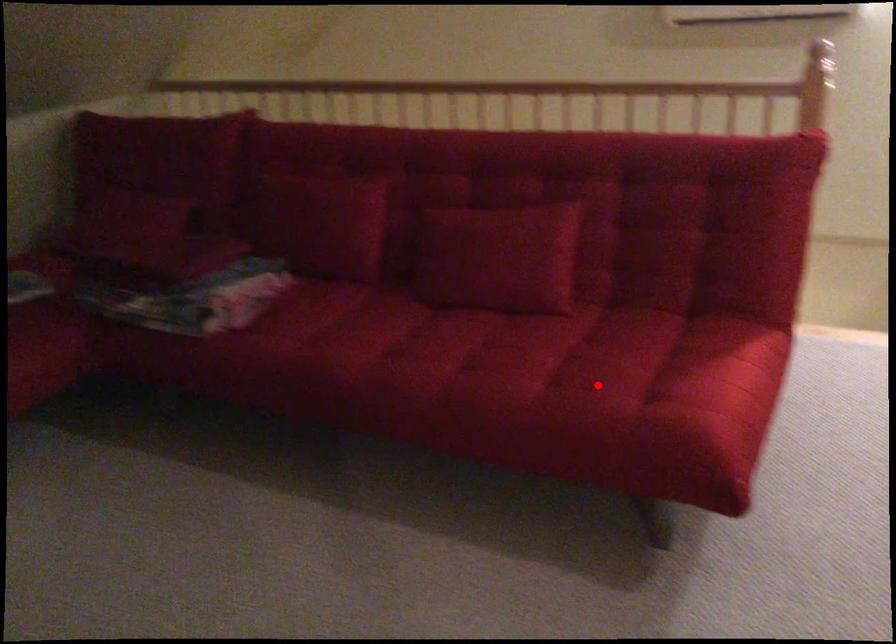
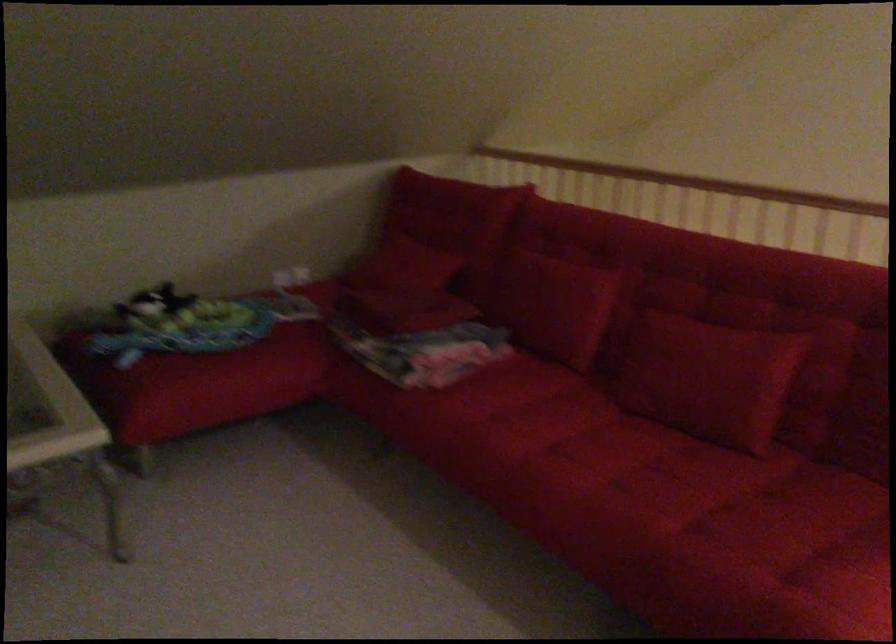
Where in the second image is the point corresponding to the highlighted location from the first image?

(754, 558)